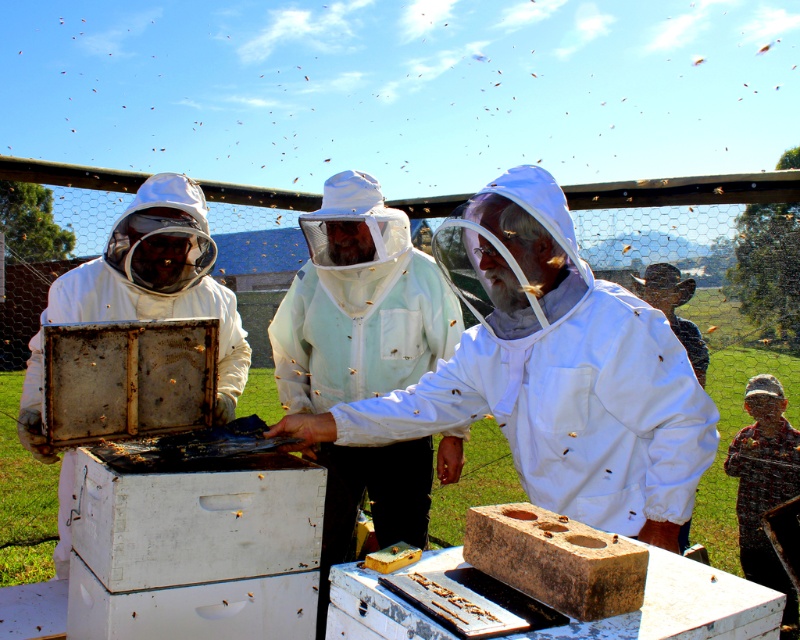
Is white fabric beekeeper at center to the left of white matte beekeeper suit at left from the viewer's perspective?

In fact, white fabric beekeeper at center is to the right of white matte beekeeper suit at left.

Does point (454, 358) lie in front of point (229, 408)?

Yes, point (454, 358) is closer to viewer.

The height and width of the screenshot is (640, 800). Identify the location of white fabric beekeeper at center. (552, 372).

Can you confirm if white fabric beekeeper at center is positioned above rusty metal beehive at center?

No.

The image size is (800, 640). What do you see at coordinates (552, 372) in the screenshot?
I see `white fabric beekeeper at center` at bounding box center [552, 372].

Find the location of a particular element. Image resolution: width=800 pixels, height=640 pixels. white fabric beekeeper at center is located at coordinates (552, 372).

Which is more to the right, white fabric beekeeper at center or brown textured block at center?

From the viewer's perspective, white fabric beekeeper at center appears more on the right side.

In the scene shown: Is white fabric beekeeper at center further to the viewer compared to brown textured block at center?

Yes, white fabric beekeeper at center is behind brown textured block at center.

Locate an element on the screen. white fabric beekeeper at center is located at coordinates (552, 372).

The width and height of the screenshot is (800, 640). Identify the location of white fabric beekeeper at center. (552, 372).